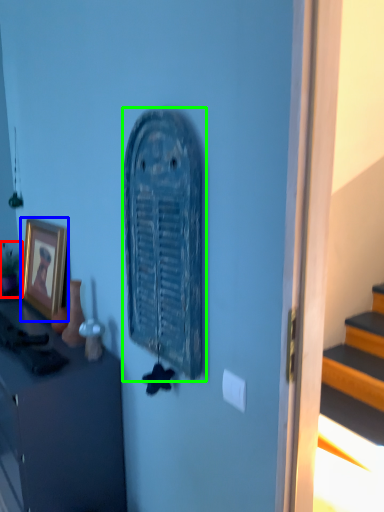
Question: Estimate the real-world distances between objects in this image. Which object is farther from houseplant (highlighted by a red box), picture frame (highlighted by a blue box) or art (highlighted by a green box)?

Choices:
 (A) picture frame
 (B) art

Answer: (B)